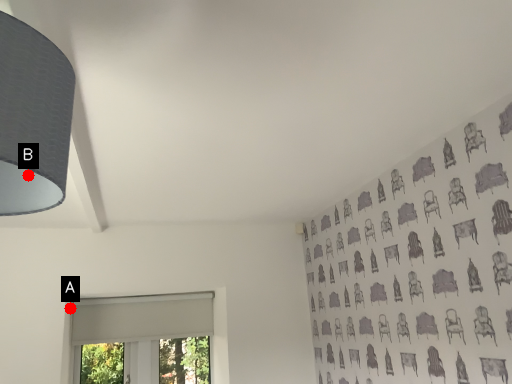
Question: Two points are circled on the image, labeled by A and B beside each circle. Which point appears farthest from the camera in this image?

Choices:
 (A) A is further
 (B) B is further

Answer: (A)